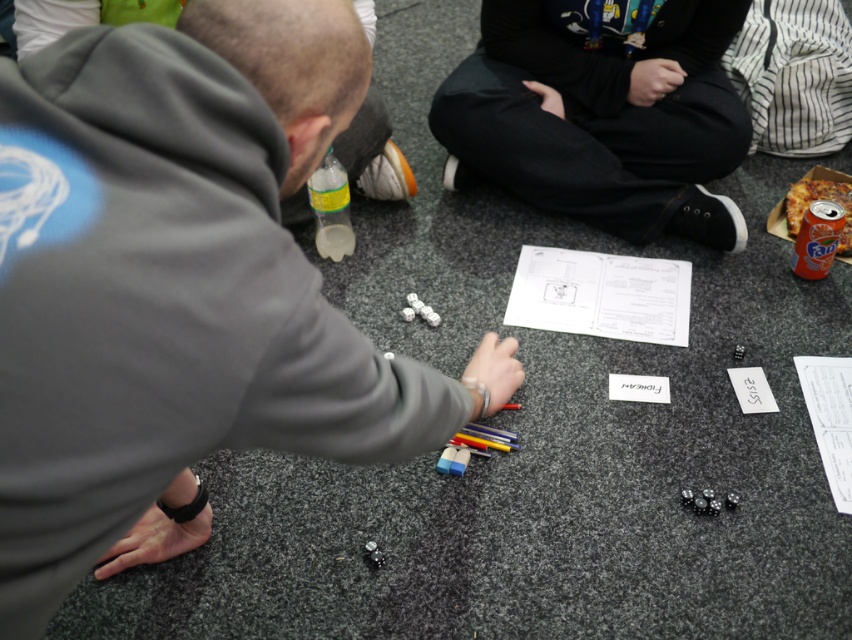
Question: Among these points, which one is farthest from the camera?

Choices:
 (A) (60, 161)
 (B) (343, 252)
 (C) (539, 90)

Answer: (C)

Question: Is matte gray hoodie at center to the left of clear plastic bottle at center from the viewer's perspective?

Choices:
 (A) no
 (B) yes

Answer: (A)

Question: Is matte gray hoodie at center to the right of clear plastic bottle at center from the viewer's perspective?

Choices:
 (A) yes
 (B) no

Answer: (A)

Question: Which point is closer to the camera?

Choices:
 (A) black cotton pants at center
 (B) clear plastic bottle at center

Answer: (B)

Question: Can you confirm if matte gray hoodie at center is wider than black cotton pants at center?

Choices:
 (A) no
 (B) yes

Answer: (A)

Question: Among these points, which one is farthest from the camera?

Choices:
 (A) (347, 204)
 (B) (78, 532)
 (C) (64, 22)
 (D) (607, 136)

Answer: (D)